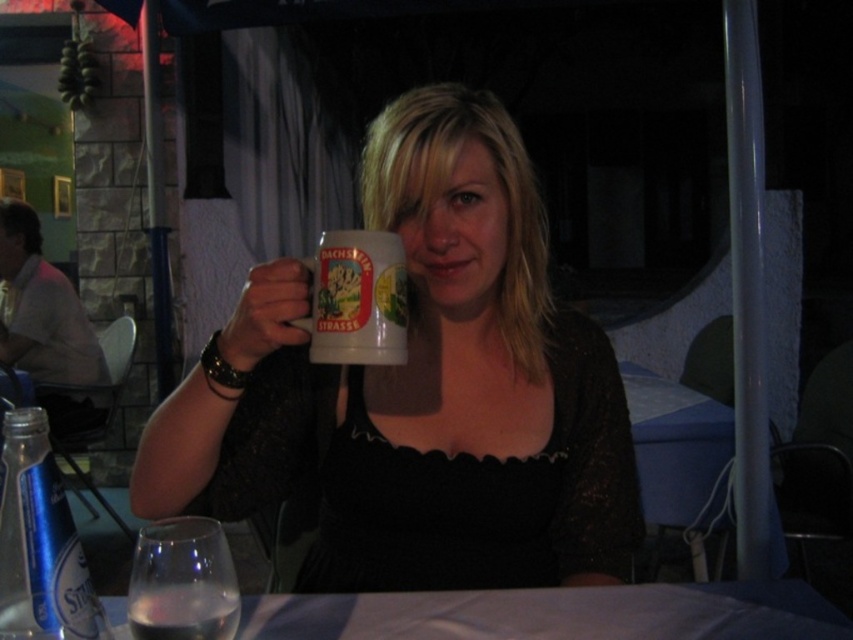
Is white ceramic mug at center thinner than clear liquid at lower left?

In fact, white ceramic mug at center might be wider than clear liquid at lower left.

Is point (357, 352) closer to camera compared to point (202, 625)?

No.

The height and width of the screenshot is (640, 853). I want to click on white ceramic mug at center, so click(357, 300).

Does point (320, 595) lie in front of point (399, 257)?

No.

Is white cloth table at center to the left of white ceramic mug at center from the viewer's perspective?

Incorrect, white cloth table at center is not on the left side of white ceramic mug at center.

Find the location of a particular element. white cloth table at center is located at coordinates (527, 616).

Who is more forward, (227, 497) or (206, 634)?

Point (206, 634) is more forward.

This screenshot has width=853, height=640. What do you see at coordinates (421, 390) in the screenshot?
I see `matte ceramic mug at center` at bounding box center [421, 390].

Find the location of a particular element. matte ceramic mug at center is located at coordinates (421, 390).